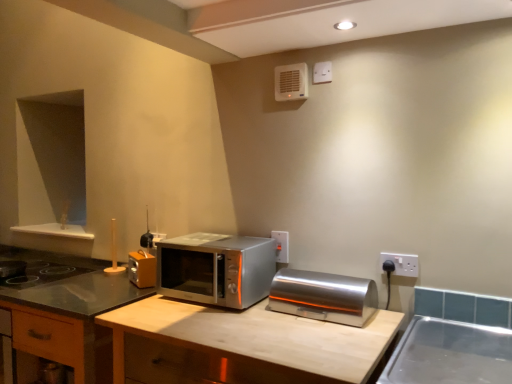
Question: Is satin silver microwave at center taller than white plastic air conditioner at upper center?

Choices:
 (A) yes
 (B) no

Answer: (A)

Question: Is satin silver microwave at center positioned behind white plastic air conditioner at upper center?

Choices:
 (A) yes
 (B) no

Answer: (B)

Question: Is satin silver microwave at center in front of white plastic air conditioner at upper center?

Choices:
 (A) yes
 (B) no

Answer: (A)

Question: Considering the relative sizes of satin silver microwave at center and white plastic air conditioner at upper center in the image provided, is satin silver microwave at center bigger than white plastic air conditioner at upper center?

Choices:
 (A) no
 (B) yes

Answer: (B)

Question: Is satin silver microwave at center oriented towards white plastic air conditioner at upper center?

Choices:
 (A) yes
 (B) no

Answer: (B)

Question: From a real-world perspective, is satin silver microwave at center physically above white plastic air conditioner at upper center?

Choices:
 (A) no
 (B) yes

Answer: (A)

Question: Does white plastic air conditioner at upper center contain wooden at center?

Choices:
 (A) no
 (B) yes

Answer: (A)

Question: Considering the relative sizes of white plastic air conditioner at upper center and wooden at center in the image provided, is white plastic air conditioner at upper center wider than wooden at center?

Choices:
 (A) yes
 (B) no

Answer: (B)

Question: Is the depth of white plastic air conditioner at upper center greater than that of wooden at center?

Choices:
 (A) yes
 (B) no

Answer: (A)

Question: Is white plastic air conditioner at upper center closer to camera compared to wooden at center?

Choices:
 (A) no
 (B) yes

Answer: (A)

Question: Does white plastic air conditioner at upper center have a lesser height compared to wooden at center?

Choices:
 (A) yes
 (B) no

Answer: (A)

Question: Is white plastic air conditioner at upper center not near wooden at center?

Choices:
 (A) no
 (B) yes

Answer: (B)

Question: Does wooden cabinet at center appear on the left side of satin silver toaster at center?

Choices:
 (A) yes
 (B) no

Answer: (A)